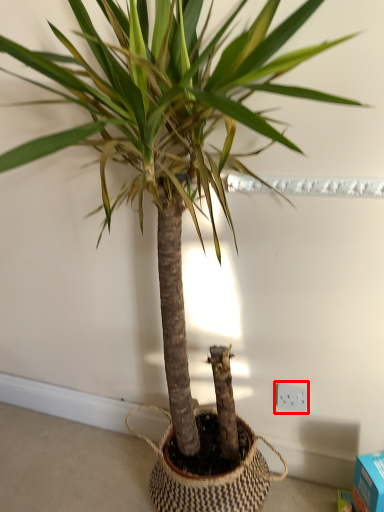
Question: Where is electric outlet (annotated by the red box) located in relation to box in the image?

Choices:
 (A) right
 (B) left

Answer: (B)